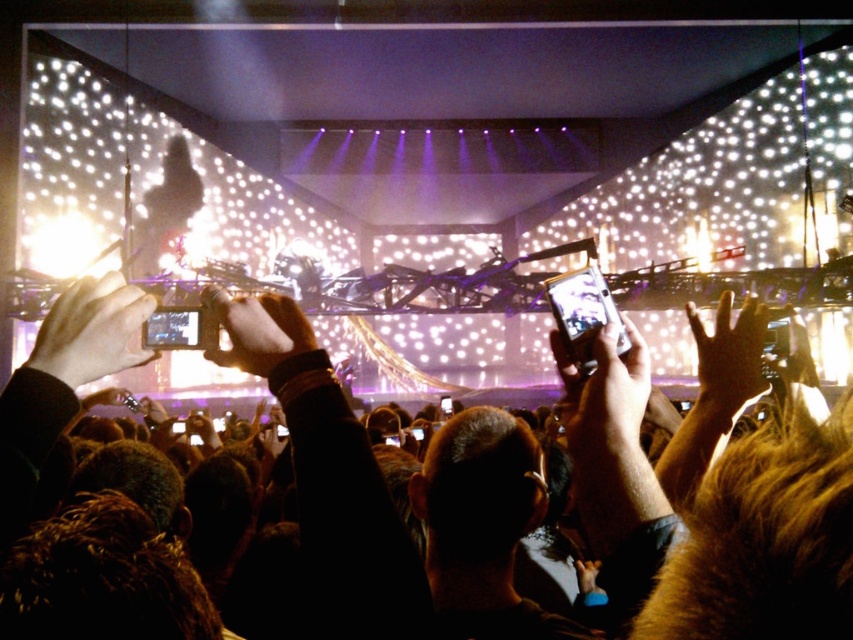
Does dark brown leather jacket at center have a lesser height compared to smooth skin hand at upper right?

Incorrect, dark brown leather jacket at center's height does not fall short of smooth skin hand at upper right's.

Between dark brown leather jacket at center and smooth skin hand at upper right, which one has less height?

smooth skin hand at upper right is shorter.

Who is more distant from viewer, (316,509) or (734,378)?

The point (734,378) is behind.

I want to click on dark brown leather jacket at center, so (728, 536).

Is point (703, 358) positioned after point (230, 360)?

Yes, point (703, 358) is farther from viewer.

Image resolution: width=853 pixels, height=640 pixels. What are the coordinates of `smooth skin hand at upper right` in the screenshot? It's located at (728, 362).

From the picture: Can you confirm if smooth skin hand at center is positioned below white matte phone at center?

Yes.

Between smooth skin hand at center and white matte phone at center, which one has less height?

white matte phone at center is shorter.

Identify the location of smooth skin hand at center. This screenshot has width=853, height=640. (604, 388).